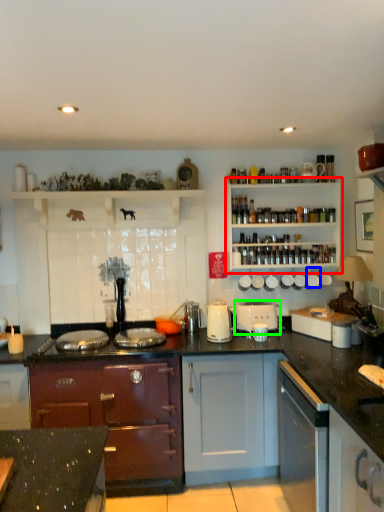
Question: Estimate the real-world distances between objects in this image. Which object is farther from shelf (highlighted by a red box), appliance (highlighted by a blue box) or appliance (highlighted by a green box)?

Choices:
 (A) appliance
 (B) appliance

Answer: (B)